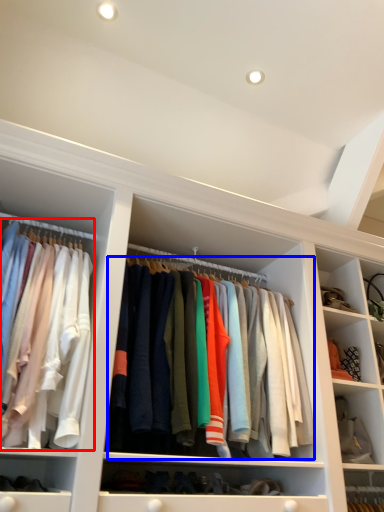
Question: Among these objects, which one is farthest to the camera, clothing (highlighted by a red box) or clothing (highlighted by a blue box)?

Choices:
 (A) clothing
 (B) clothing

Answer: (B)